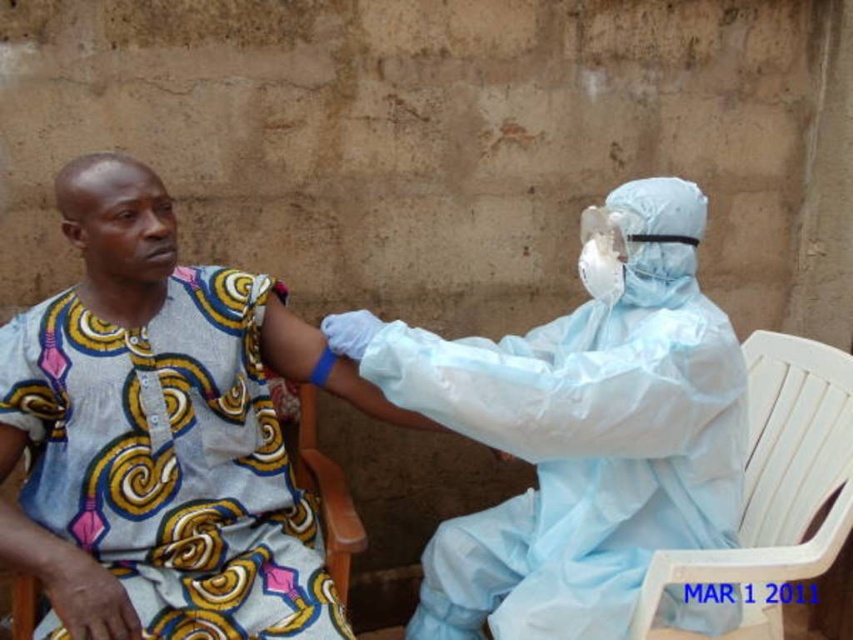
Which is more to the left, light blue protective suit at center or wooden chair at lower center?

Positioned to the left is wooden chair at lower center.

Is point (572, 513) closer to camera compared to point (321, 461)?

Yes, it is.

Identify the location of light blue protective suit at center. The width and height of the screenshot is (853, 640). (579, 433).

Which is behind, point (534, 460) or point (833, 529)?

Point (833, 529)

From the picture: Is light blue protective suit at center to the left of white plastic chair at right from the viewer's perspective?

Yes, light blue protective suit at center is to the left of white plastic chair at right.

What do you see at coordinates (579, 433) in the screenshot? Image resolution: width=853 pixels, height=640 pixels. I see `light blue protective suit at center` at bounding box center [579, 433].

Locate an element on the screen. Image resolution: width=853 pixels, height=640 pixels. light blue protective suit at center is located at coordinates (579, 433).

Is white plastic chair at right in front of wooden chair at lower center?

Yes.

Is white plastic chair at right shorter than wooden chair at lower center?

In fact, white plastic chair at right may be taller than wooden chair at lower center.

Between point (738, 560) and point (340, 545), which one is positioned behind?

Point (340, 545)

I want to click on white plastic chair at right, so click(775, 490).